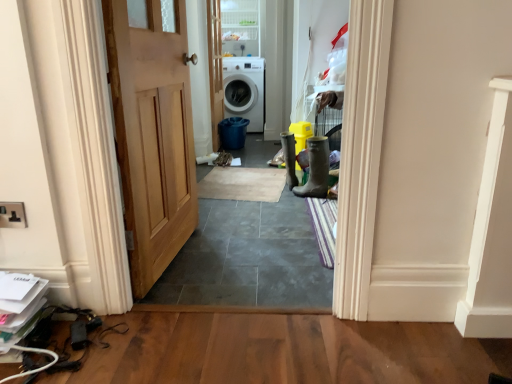
Question: Considering the relative positions of white glossy washing machine at center and clear glass door at upper center in the image provided, is white glossy washing machine at center to the right of clear glass door at upper center from the viewer's perspective?

Choices:
 (A) yes
 (B) no

Answer: (A)

Question: Can you confirm if white glossy washing machine at center is bigger than clear glass door at upper center?

Choices:
 (A) yes
 (B) no

Answer: (A)

Question: Is white glossy washing machine at center surrounding clear glass door at upper center?

Choices:
 (A) no
 (B) yes

Answer: (A)

Question: Is white glossy washing machine at center behind clear glass door at upper center?

Choices:
 (A) no
 (B) yes

Answer: (B)

Question: Can you confirm if white glossy washing machine at center is shorter than clear glass door at upper center?

Choices:
 (A) yes
 (B) no

Answer: (B)

Question: Is white glossy washing machine at center placed right next to clear glass door at upper center?

Choices:
 (A) yes
 (B) no

Answer: (B)

Question: Can white glossy washing machine at center be found inside clear glass door at upper center?

Choices:
 (A) no
 (B) yes

Answer: (A)

Question: From the image's perspective, does clear glass door at upper center appear lower than white glossy washing machine at center?

Choices:
 (A) no
 (B) yes

Answer: (A)

Question: From a real-world perspective, is clear glass door at upper center positioned under white glossy washing machine at center based on gravity?

Choices:
 (A) no
 (B) yes

Answer: (A)

Question: Is there a large distance between clear glass door at upper center and white glossy washing machine at center?

Choices:
 (A) no
 (B) yes

Answer: (A)

Question: Is clear glass door at upper center next to white glossy washing machine at center and touching it?

Choices:
 (A) yes
 (B) no

Answer: (B)

Question: Is the position of clear glass door at upper center more distant than that of white glossy washing machine at center?

Choices:
 (A) yes
 (B) no

Answer: (B)

Question: Is natural wood door at center, positioned as the second door in back-to-front order, a part of white glossy washing machine at center?

Choices:
 (A) yes
 (B) no

Answer: (B)